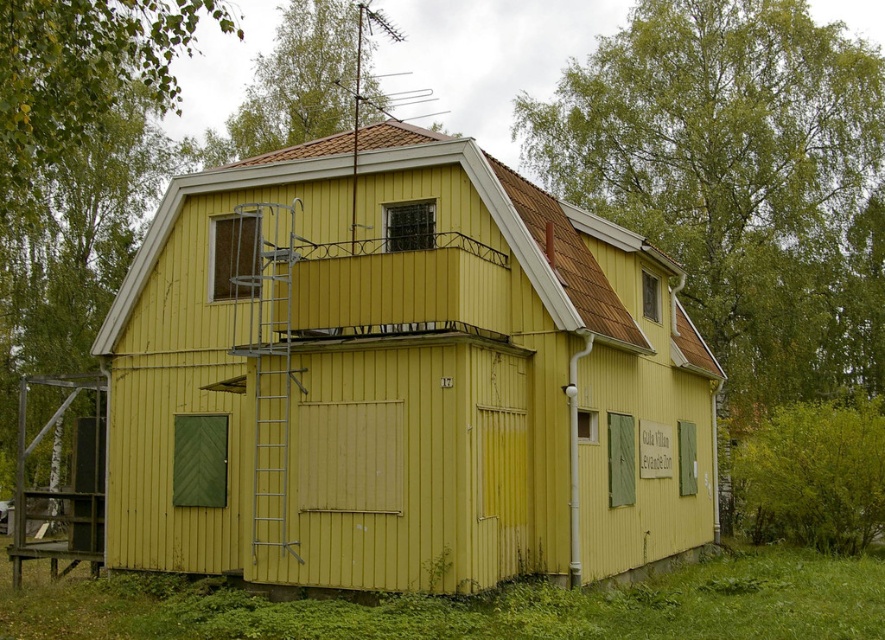
Question: Does yellow wood cabin at center have a lesser width compared to silver metallic ladder at center?

Choices:
 (A) no
 (B) yes

Answer: (A)

Question: Can you confirm if silver metallic ladder at center is smaller than wooden scaffolding at left?

Choices:
 (A) no
 (B) yes

Answer: (B)

Question: Is yellow wood cabin at center further to camera compared to silver metallic ladder at center?

Choices:
 (A) yes
 (B) no

Answer: (B)

Question: Which of these objects is positioned closest to the yellow wood cabin at center?

Choices:
 (A) wooden scaffolding at left
 (B) silver metallic ladder at center

Answer: (B)

Question: Which of the following is the closest to the observer?

Choices:
 (A) (414, 291)
 (B) (36, 378)

Answer: (A)

Question: Which point appears closest to the camera in this image?

Choices:
 (A) (287, 204)
 (B) (14, 570)

Answer: (A)